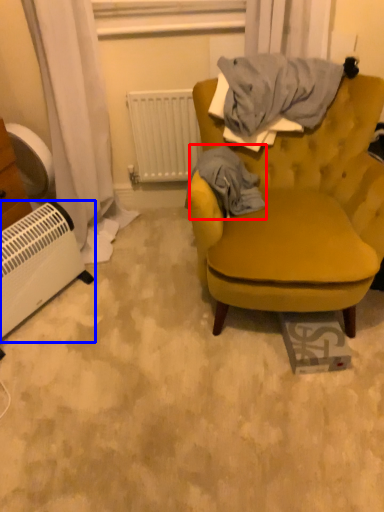
Question: Which point is closer to the camera, blanket (highlighted by a red box) or appliance (highlighted by a blue box)?

Choices:
 (A) blanket
 (B) appliance

Answer: (B)